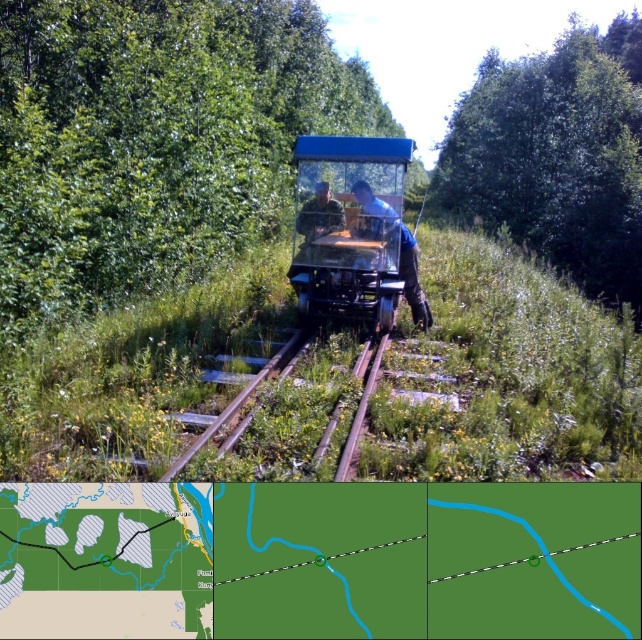
Which of these two, transparent plastic train at center or camouflage fabric man at center, stands shorter?

Standing shorter between the two is camouflage fabric man at center.

Is point (360, 227) in front of point (340, 204)?

Yes, it is.

Where is `transparent plastic train at center`? transparent plastic train at center is located at coordinates (354, 230).

Which is more to the right, metal/smooth train track at center or camouflage fabric man at center?

From the viewer's perspective, camouflage fabric man at center appears more on the right side.

Does metal/smooth train track at center have a larger size compared to camouflage fabric man at center?

Yes, metal/smooth train track at center is bigger than camouflage fabric man at center.

What do you see at coordinates (229, 410) in the screenshot?
I see `metal/smooth train track at center` at bounding box center [229, 410].

Identify the location of metal/smooth train track at center. pyautogui.click(x=229, y=410).

Can you confirm if green leafy tree at upper center is wider than blue transparent vehicle at center?

Yes.

Which is more to the left, green leafy tree at upper center or blue transparent vehicle at center?

From the viewer's perspective, blue transparent vehicle at center appears more on the left side.

Does point (514, 90) lie behind point (392, 212)?

That is True.

Where is `green leafy tree at upper center`? The image size is (642, 640). green leafy tree at upper center is located at coordinates (557, 156).